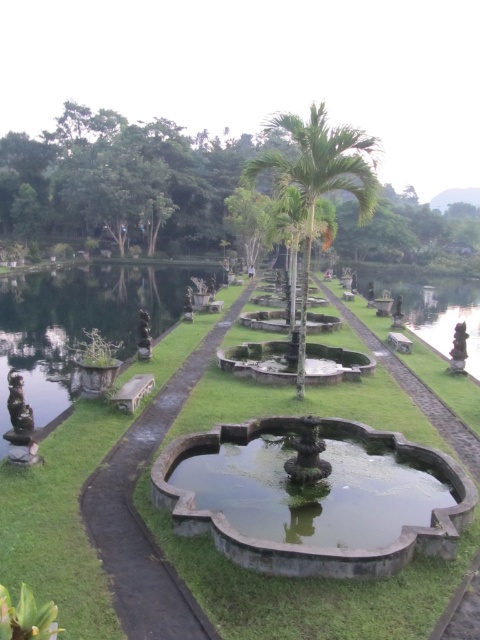
You are a gardener who needs to place a new statue that is 2 meters tall in the garden. Considering the dark gray stone path at center and the green leafy palm tree at center, which object would be more suitable for placing the statue without blocking the view of the other?

The dark gray stone path at center is not as tall as the green leafy palm tree at center, so placing the statue on the path would allow it to be seen without blocking the view of the palm tree.

You are a gardener who needs to water the green grass at center and the dark gray stone path at center. If your watering hose can only reach 2 meters, will you be able to water both areas from your current position without moving the hose?

The distance between the green grass at center and the dark gray stone path at center is 2.16 meters, which exceeds the 2 meter reach of the hose. Therefore, you cannot water both areas without moving the hose.

You are standing at the entrance of the garden and want to reach the green grass at center. According to the garden layout, which direction should you move from your current position to reach it?

The green grass at center is located at point (309,592), so you should move forward and towards the center of the garden to reach it.